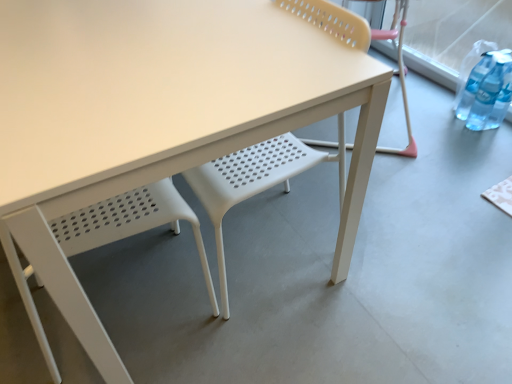
Question: Should I look upward or downward to see matte plastic chair at right, acting as the 2th chair starting from the left?

Choices:
 (A) down
 (B) up

Answer: (B)

Question: Is white plastic chair at lower left, which is the 2th chair in top-to-bottom order, bigger than matte plastic chair at right, positioned as the second chair in front-to-back order?

Choices:
 (A) no
 (B) yes

Answer: (A)

Question: Is white plastic chair at lower left, which appears as the first chair when viewed from the front, smaller than matte plastic chair at right, which is the second chair in bottom-to-top order?

Choices:
 (A) yes
 (B) no

Answer: (A)

Question: From a real-world perspective, is white plastic chair at lower left, the 1th chair in the left-to-right sequence, on matte plastic chair at right, which is the second chair in bottom-to-top order?

Choices:
 (A) no
 (B) yes

Answer: (B)

Question: From the image's perspective, is white plastic chair at lower left, positioned as the 1th chair in bottom-to-top order, above matte plastic chair at right, the 1th chair viewed from the top?

Choices:
 (A) yes
 (B) no

Answer: (B)

Question: Is white plastic chair at lower left, positioned as the 1th chair in bottom-to-top order, oriented towards matte plastic chair at right, the 1th chair in the right-to-left sequence?

Choices:
 (A) no
 (B) yes

Answer: (B)

Question: Is white plastic chair at lower left, acting as the 2th chair starting from the right, beside matte plastic chair at right, the 1th chair viewed from the top?

Choices:
 (A) no
 (B) yes

Answer: (A)

Question: Could white plastic chair at lower left, which is the 2th chair in top-to-bottom order, be considered to be inside matte plastic chair at right, the 1th chair in the right-to-left sequence?

Choices:
 (A) yes
 (B) no

Answer: (B)

Question: Can you confirm if matte plastic chair at right, positioned as the second chair in front-to-back order, is bigger than white plastic chair at lower left, positioned as the 1th chair in bottom-to-top order?

Choices:
 (A) yes
 (B) no

Answer: (A)

Question: Considering the relative sizes of matte plastic chair at right, positioned as the second chair in front-to-back order, and white plastic chair at lower left, which is the 2th chair in top-to-bottom order, in the image provided, is matte plastic chair at right, positioned as the second chair in front-to-back order, thinner than white plastic chair at lower left, which is the 2th chair in top-to-bottom order,?

Choices:
 (A) yes
 (B) no

Answer: (B)

Question: Is matte plastic chair at right, which appears as the first chair when viewed from the back, completely or partially outside of white plastic chair at lower left, which appears as the first chair when viewed from the front?

Choices:
 (A) yes
 (B) no

Answer: (A)

Question: Does matte plastic chair at right, positioned as the second chair in front-to-back order, touch white plastic chair at lower left, which appears as the first chair when viewed from the front?

Choices:
 (A) yes
 (B) no

Answer: (B)

Question: From a real-world perspective, is matte plastic chair at right, the 1th chair in the right-to-left sequence, under white plastic chair at lower left, which appears as the first chair when viewed from the front?

Choices:
 (A) no
 (B) yes

Answer: (B)

Question: From a real-world perspective, is matte plastic chair at right, acting as the 2th chair starting from the left, positioned above or below white plastic chair at lower left, which ranks as the 2th chair in back-to-front order?

Choices:
 (A) below
 (B) above

Answer: (A)